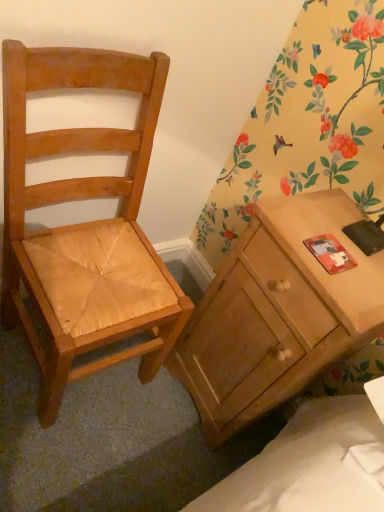
This screenshot has width=384, height=512. Find the location of `blank space situated above matte wood desk at right (from a real-world perspective)`. blank space situated above matte wood desk at right (from a real-world perspective) is located at coordinates (339, 248).